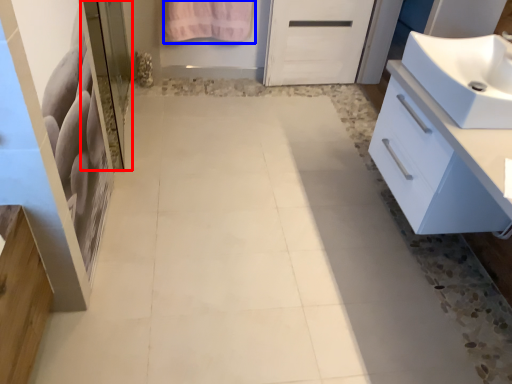
Question: Which point is further to the camera, screen door (highlighted by a red box) or bath towel (highlighted by a blue box)?

Choices:
 (A) screen door
 (B) bath towel

Answer: (B)